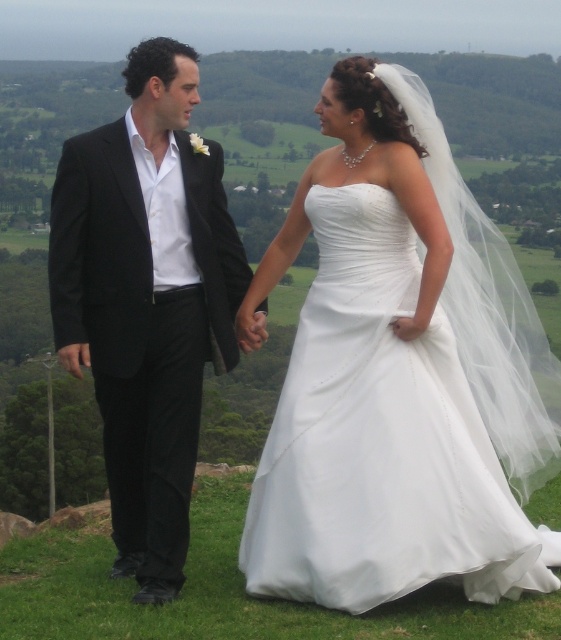
You are a photographer positioned at the camera. You want to capture a closeup shot of the white satin dress at center. Given that you are currently 6.16 meters away, should you move closer or farther away to achieve this?

To capture a closeup shot of the white satin dress at center, you need to move closer since the current distance of 6.16 meters is too far for a closeup.

You are a photographer positioned behind the couple to capture their wedding photos. You notice the white satin dress at center and the matte black suit at left. Which clothing item is closer to you?

The white satin dress at center is closer to you since it is in front of the matte black suit at left.